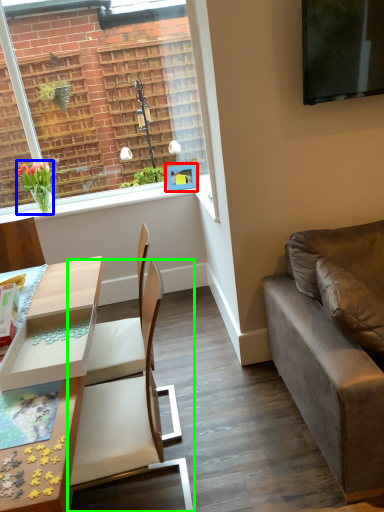
Question: Which object is positioned farthest from picture frame (highlighted by a red box)? Select from houseplant (highlighted by a blue box) and chair (highlighted by a green box).

Choices:
 (A) houseplant
 (B) chair

Answer: (B)